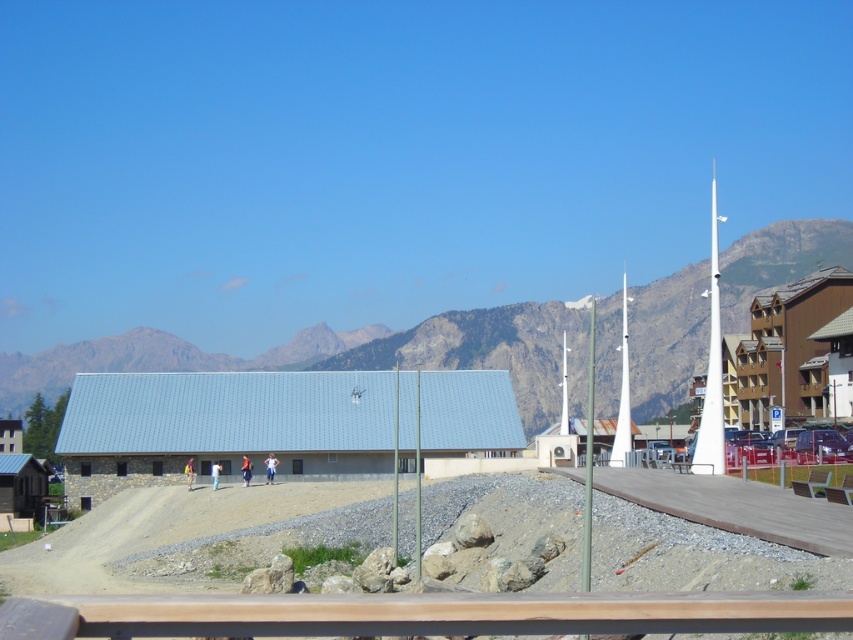
You are an architect designing a new park layout. You need to place a bench between the brown wooden rail at lower center and the white glossy flag pole at center. Given their widths, which object requires more space to accommodate the bench?

The white glossy flag pole at center requires more space because it has a greater width than the brown wooden rail at lower center.

You are standing at the wooden railing on the platform and want to walk towards the large light colored building in the midground. You see two points marked as point 1 at (x=718, y=392) and point 2 at (x=567, y=410). Which point should you head towards to get closer to the building?

You should head towards point 2 at (x=567, y=410) because it is behind point 1 at (x=718, y=392), placing it closer to the large light colored building in the midground.